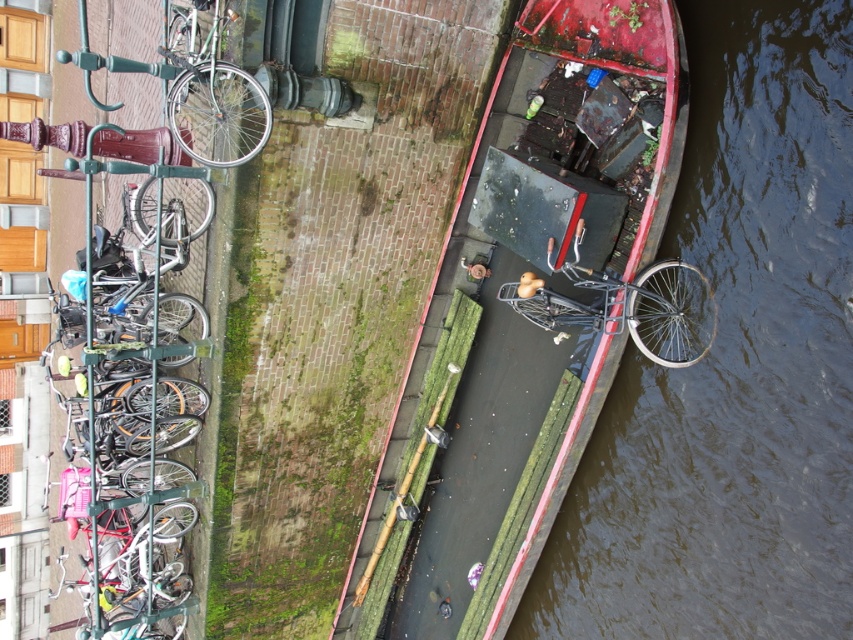
You are a delivery person standing on the canal boat and need to place a package on the shiny black bicycle at center. The package is 1.2 meters tall. Can you safely place it there without the top of the package touching the dark brown water at lower right?

The dark brown water at lower right is taller than the shiny black bicycle at center. Since the package is 1.2 meters tall, placing it on the bicycle may cause the top of the package to touch the water if the bicycle is positioned lower. However, without knowing the exact height difference between the bicycle and the water, it is difficult to determine definitively. But according to the description, the water is taller than the bicycle, so the top of the package might extend into the water.

You are standing at the origin point of the coordinate system in the image. The rusty metal boat at center is located at point 0.450, 0.640. If you want to move towards the boat, in which direction should you move?

Since the rusty metal boat at center is located at coordinates (544, 288), you should move towards the positive x and y directions to reach it from the origin.